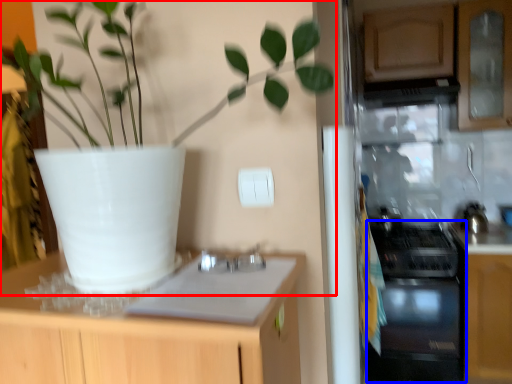
Question: Which point is closer to the camera, houseplant (highlighted by a red box) or oven (highlighted by a blue box)?

Choices:
 (A) houseplant
 (B) oven

Answer: (A)